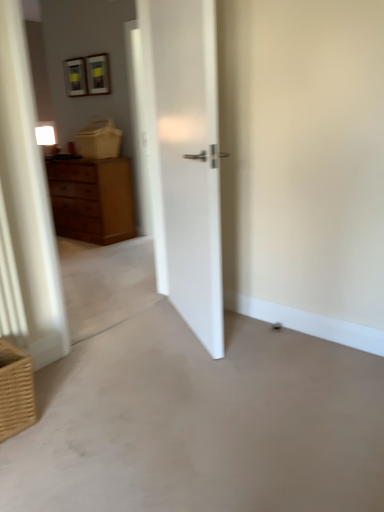
Locate an element on the screen. This screenshot has height=512, width=384. vacant space situated above smooth concrete floor at center (from a real-world perspective) is located at coordinates (202, 400).